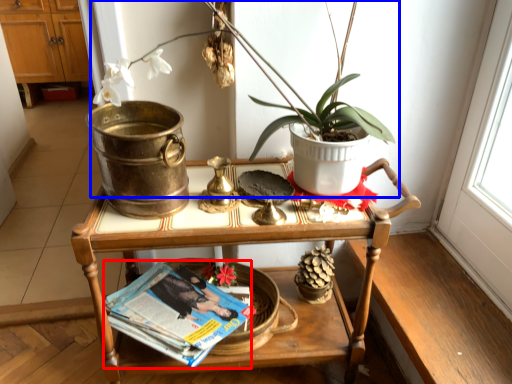
Question: Which of the following is the closest to the observer, magazine (highlighted by a red box) or houseplant (highlighted by a blue box)?

Choices:
 (A) magazine
 (B) houseplant

Answer: (B)